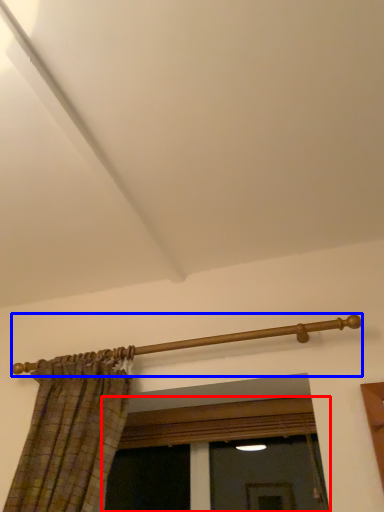
Question: Which object is further to the camera taking this photo, window (highlighted by a red box) or rail (highlighted by a blue box)?

Choices:
 (A) window
 (B) rail

Answer: (A)